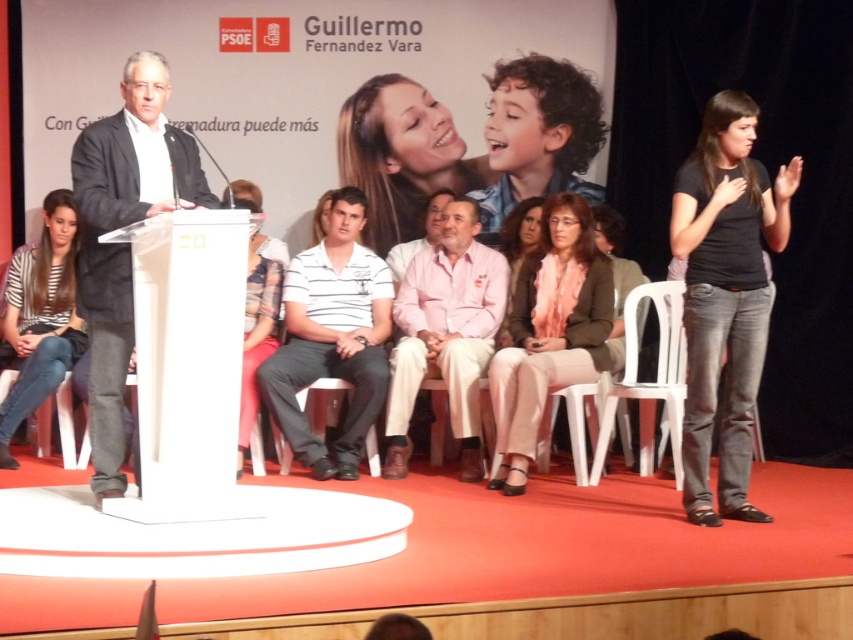
Question: Does dark gray suit at left appear on the right side of white plastic chair at center?

Choices:
 (A) yes
 (B) no

Answer: (B)

Question: Does pink cotton shirt at center appear under white plastic chair at center?

Choices:
 (A) yes
 (B) no

Answer: (B)

Question: Which point is closer to the camera?

Choices:
 (A) (724, 184)
 (B) (274, 433)
 (C) (444, 289)
 (D) (274, 323)

Answer: (A)

Question: Which is nearer to the smooth beige blouse at center?

Choices:
 (A) dark gray suit at left
 (B) striped fabric shirt at lower left
 (C) striped fabric shirt at center
 (D) white plastic chair at center

Answer: (C)

Question: Which is nearer to the striped fabric shirt at lower left?

Choices:
 (A) smooth beige blouse at center
 (B) pink cotton shirt at center
 (C) matte pink sweater at center
 (D) light beige pants at center

Answer: (A)

Question: Does smooth beige blouse at center appear on the right side of matte pink sweater at center?

Choices:
 (A) yes
 (B) no

Answer: (B)